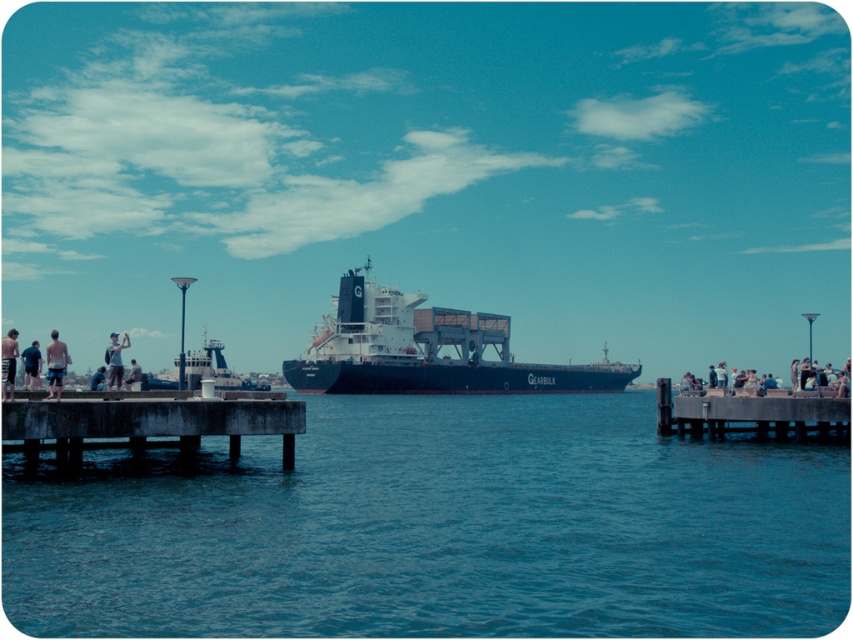
Question: Which point is closer to the camera?

Choices:
 (A) black shorts at left
 (B) light blue denim jeans at right

Answer: (A)

Question: Which object is farther from the camera taking this photo?

Choices:
 (A) light blue denim shorts at left
 (B) light gray fabric jacket at left

Answer: (B)

Question: Does metallic gray ship at center have a smaller size compared to light blue denim jeans at right?

Choices:
 (A) yes
 (B) no

Answer: (A)

Question: Does blue matte cargo ship at center appear under concrete pier at right?

Choices:
 (A) yes
 (B) no

Answer: (B)

Question: Can you confirm if blue water at center is smaller than metallic gray ship at center?

Choices:
 (A) no
 (B) yes

Answer: (B)

Question: Which of the following is the farthest from the observer?

Choices:
 (A) (112, 365)
 (B) (122, 384)
 (C) (239, 387)
 (D) (93, 372)

Answer: (D)